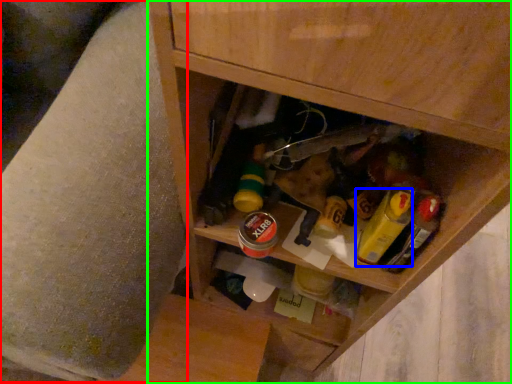
Question: Which object is positioned closest to swivel chair (highlighted by a red box)? Select from mustard (highlighted by a blue box) and cabinetry (highlighted by a green box).

Choices:
 (A) mustard
 (B) cabinetry

Answer: (B)